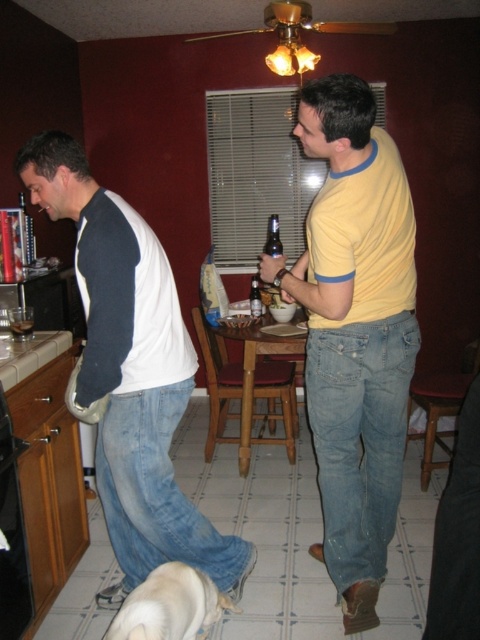
Is yellow matte shirt at center bigger than matte glass beer bottle at center?

Indeed, yellow matte shirt at center has a larger size compared to matte glass beer bottle at center.

What do you see at coordinates (355, 332) in the screenshot?
I see `yellow matte shirt at center` at bounding box center [355, 332].

Where is `yellow matte shirt at center`? Image resolution: width=480 pixels, height=640 pixels. yellow matte shirt at center is located at coordinates (355, 332).

Based on the photo, measure the distance between point (105, 385) and camera.

They are 1.74 meters apart.

Describe the element at coordinates (131, 372) in the screenshot. I see `white cotton shirt at left` at that location.

Between point (134, 244) and point (253, 291), which one is positioned in front?

Point (134, 244) is in front.

Locate an element on the screen. This screenshot has width=480, height=640. white cotton shirt at left is located at coordinates (131, 372).

Which is behind, point (202, 612) or point (16, 332)?

Point (16, 332)

Which is in front, point (197, 595) or point (12, 324)?

Point (197, 595) is in front.

You are a GUI agent. You are given a task and a screenshot of the screen. Output one action in this format:
    pyautogui.click(x=<x>, y=<y>)
    Task: Click on the white fur dog at lower center
    The width and height of the screenshot is (480, 640).
    Given the screenshot: What is the action you would take?
    pyautogui.click(x=169, y=605)